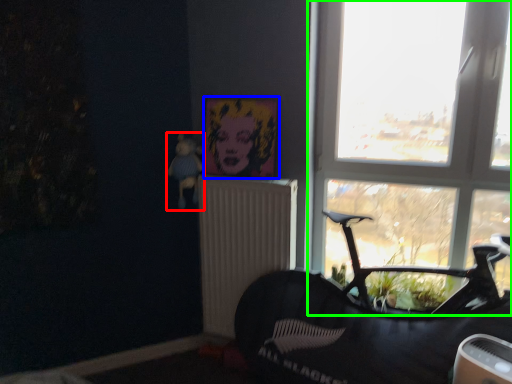
Question: Based on their relative distances, which object is nearer to toy (highlighted by a red box)? Choose from picture frame (highlighted by a blue box) and window (highlighted by a green box).

Choices:
 (A) picture frame
 (B) window

Answer: (A)